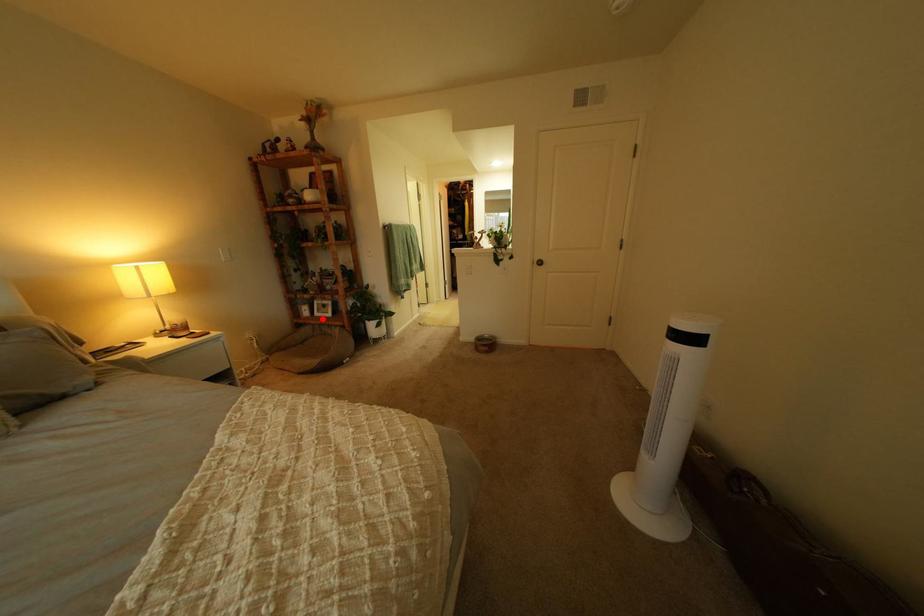
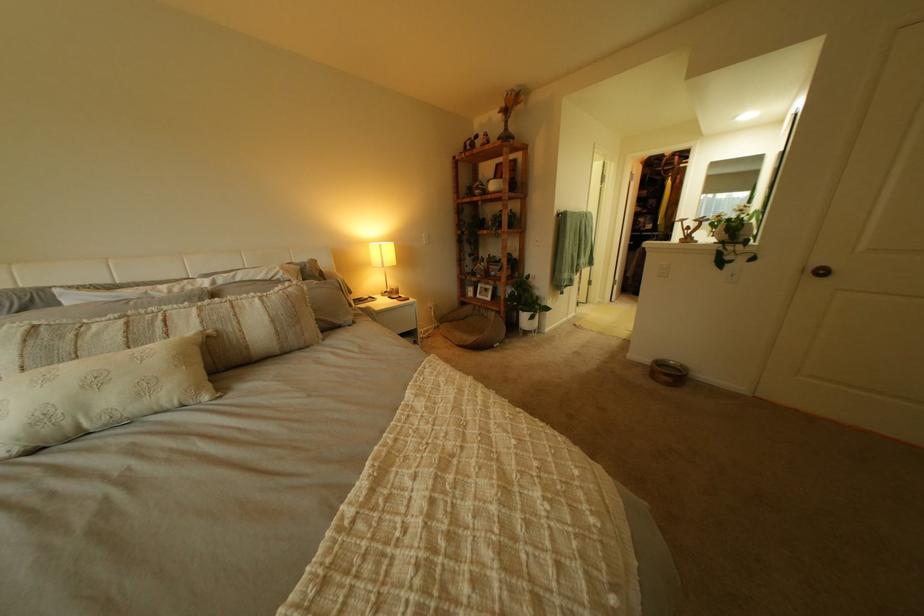
Find the pixel in the second image that matches the highlighted location in the first image.

(485, 300)